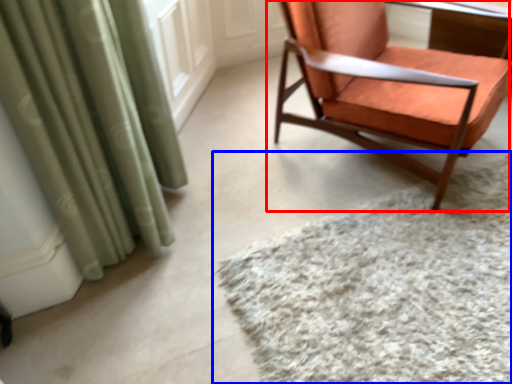
Question: Which object is closer to the camera taking this photo, chair (highlighted by a red box) or mat (highlighted by a blue box)?

Choices:
 (A) chair
 (B) mat

Answer: (B)